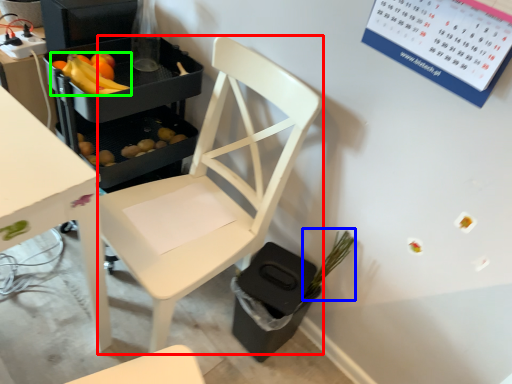
Question: Which object is positioned closest to chair (highlighted by a red box)? Select from plant (highlighted by a blue box) and banana (highlighted by a green box).

Choices:
 (A) plant
 (B) banana

Answer: (A)